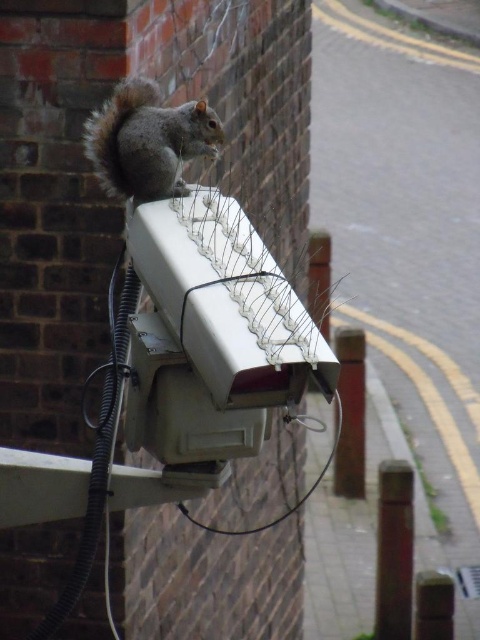
You are a delivery robot that needs to navigate between the smooth brown pole at lower right and the metallic pole at center. Which pole should you avoid if you want to choose the wider path between them?

The smooth brown pole at lower right is thinner than the metallic pole at center, so the wider path would be next to the metallic pole at center since it has a larger diameter.

You are a delivery drone that needs to land on the metallic pole at center. There is a metallic wire at upper center above it. Can you land safely without hitting the wire?

The metallic pole at center is positioned under the metallic wire at upper center, so you can land safely as long as you approach vertically and avoid the wire above.

You are a delivery robot navigating a sidewalk. You see a smooth brown pole at lower right and a metallic pole at center. Which pole should you avoid to stay closer to the road?

The smooth brown pole at lower right is closer to the viewer than the metallic pole at center, so to stay closer to the road, you should avoid the metallic pole at center and stay near the smooth brown pole at lower right.